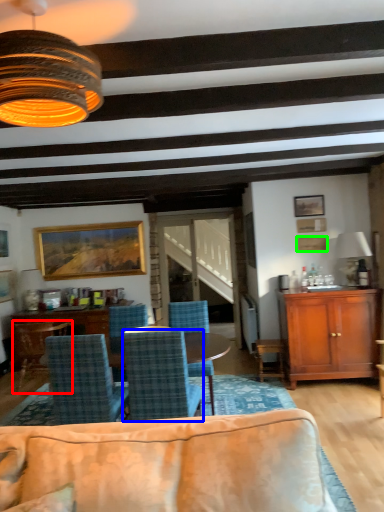
Question: Considering the real-world distances, which object is closest to chair (highlighted by a red box)? chair (highlighted by a blue box) or picture frame (highlighted by a green box).

Choices:
 (A) chair
 (B) picture frame

Answer: (A)